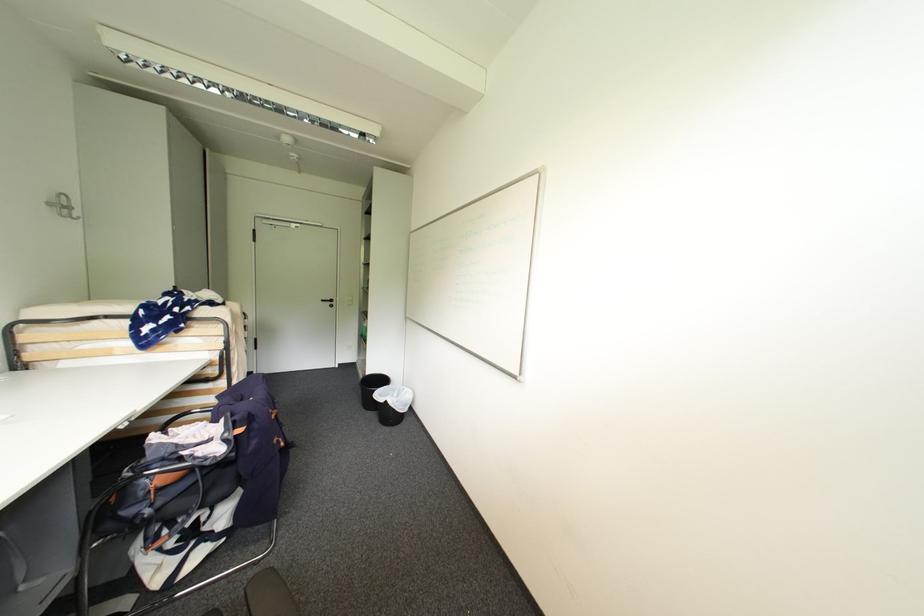
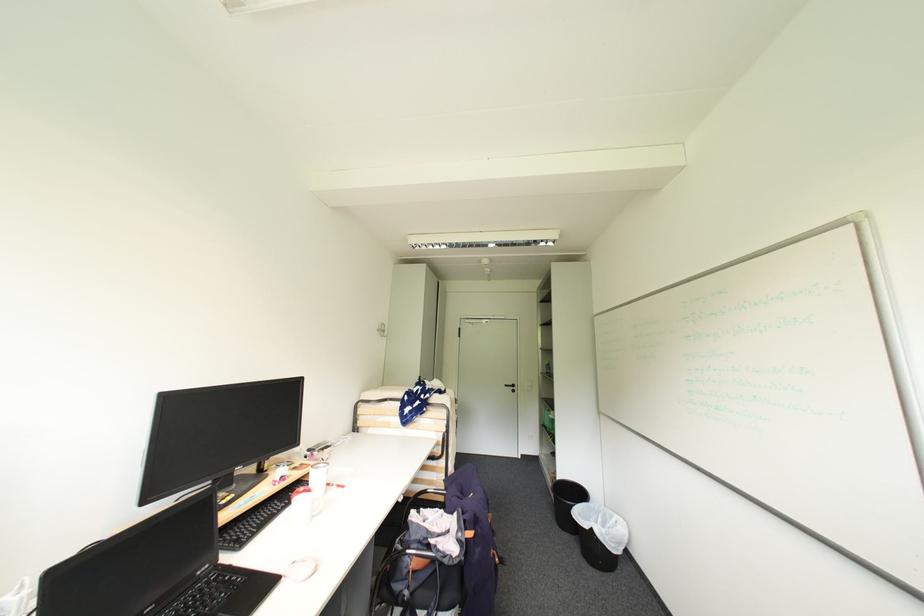
Locate, in the second image, the point that corresponds to the point at 393,387 in the first image.

(591, 505)